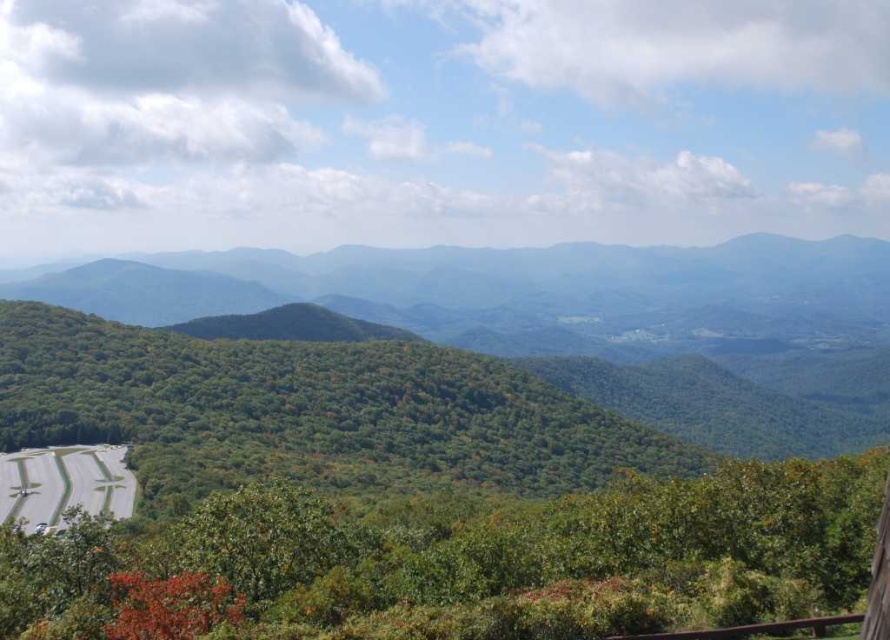
Question: Which of the following is the closest to the observer?

Choices:
 (A) (785, 433)
 (B) (100, 509)

Answer: (B)

Question: Among these objects, which one is nearest to the camera?

Choices:
 (A) green leafy forest at left
 (B) green asphalt road at lower left

Answer: (B)

Question: Does green leafy forest at left have a lesser width compared to green asphalt road at lower left?

Choices:
 (A) no
 (B) yes

Answer: (A)

Question: Is green leafy forest at left to the left of green asphalt road at lower left from the viewer's perspective?

Choices:
 (A) yes
 (B) no

Answer: (B)

Question: Observing the image, what is the correct spatial positioning of green leafy forest at left in reference to green asphalt road at lower left?

Choices:
 (A) above
 (B) below

Answer: (A)